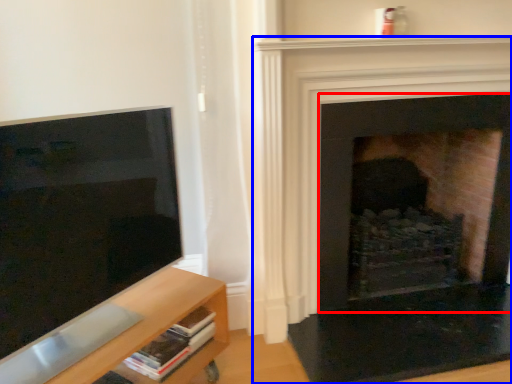
Question: Which of the following is the farthest to the observer, fireplace (highlighted by a red box) or fireplace (highlighted by a blue box)?

Choices:
 (A) fireplace
 (B) fireplace

Answer: (A)